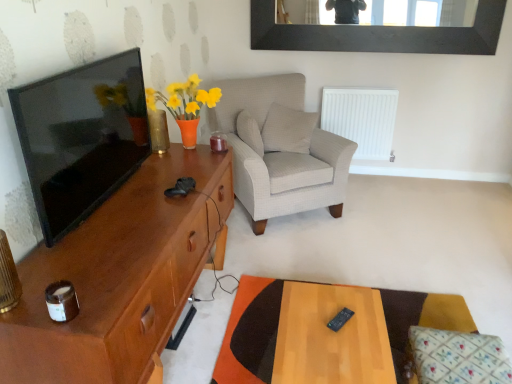
Find the location of a particular element. free location to the right of light gray fabric armchair at center is located at coordinates (389, 214).